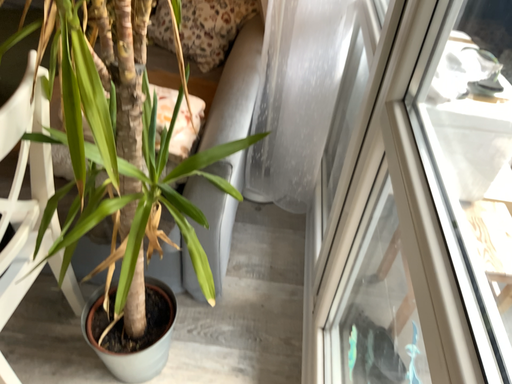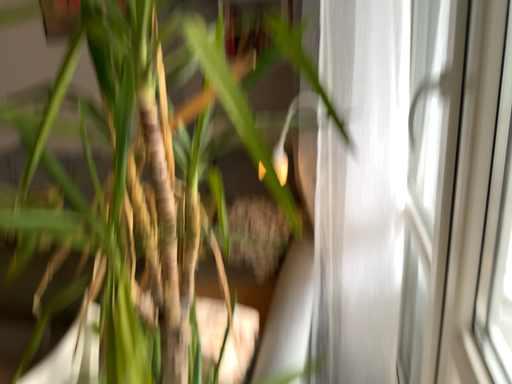
Question: How did the camera likely rotate when shooting the video?

Choices:
 (A) rotated downward
 (B) rotated upward

Answer: (B)